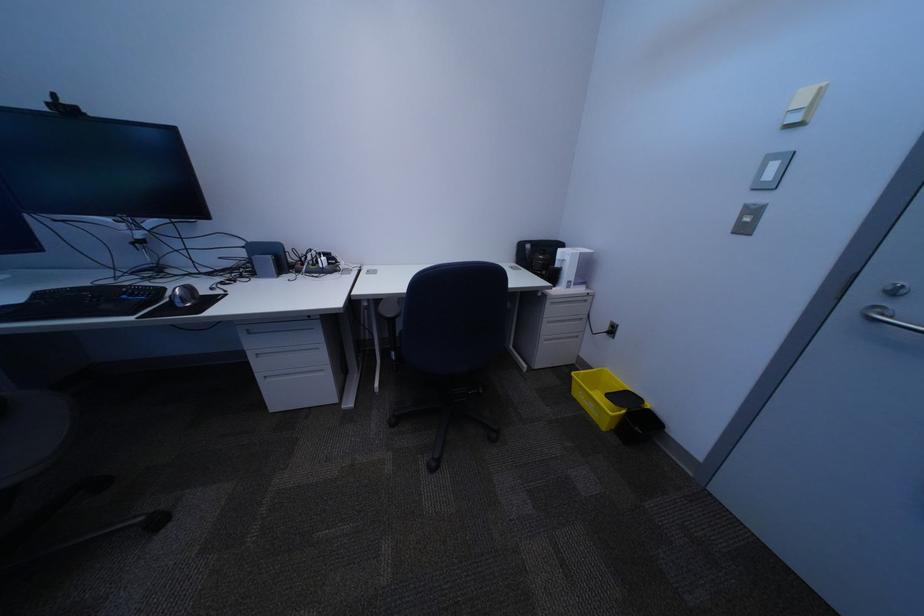
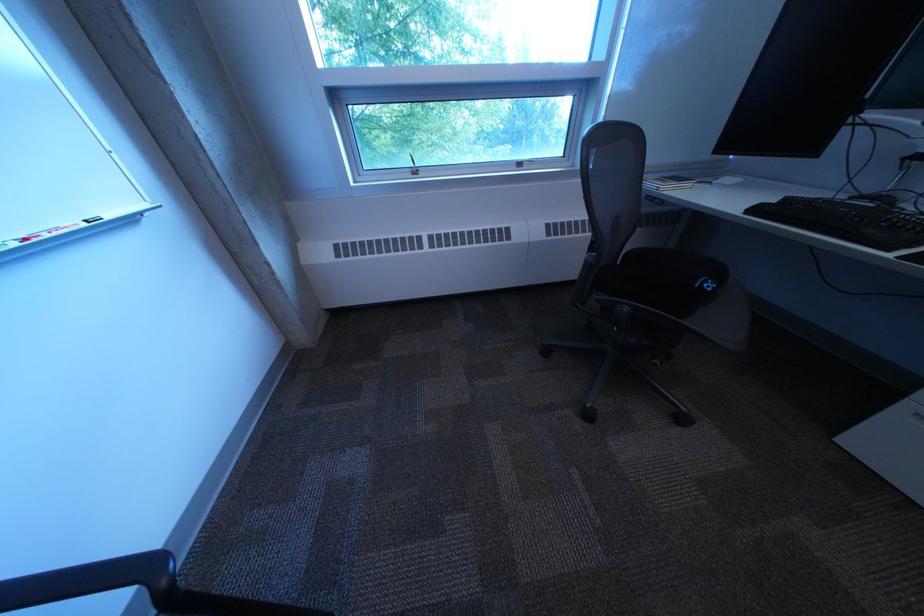
The images are taken continuously from a first-person perspective. In which direction is your viewpoint rotating?

The camera rotated toward left-down.